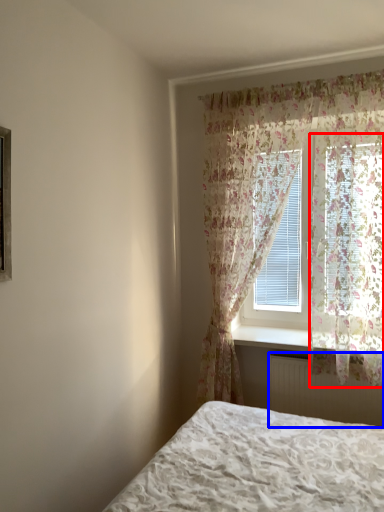
Question: Among these objects, which one is nearest to the camera, curtain (highlighted by a red box) or radiator (highlighted by a blue box)?

Choices:
 (A) curtain
 (B) radiator

Answer: (A)